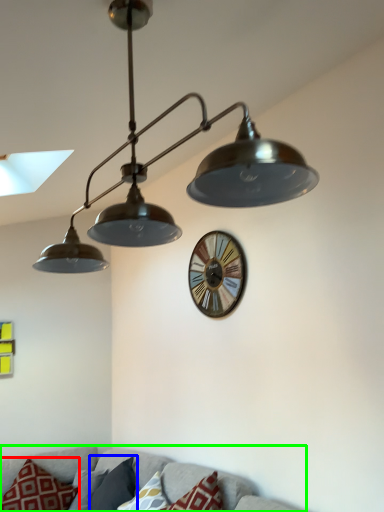
Question: Which object is positioned farthest from pillow (highlighted by a red box)? Select from pillow (highlighted by a blue box) and couch (highlighted by a green box).

Choices:
 (A) pillow
 (B) couch

Answer: (B)